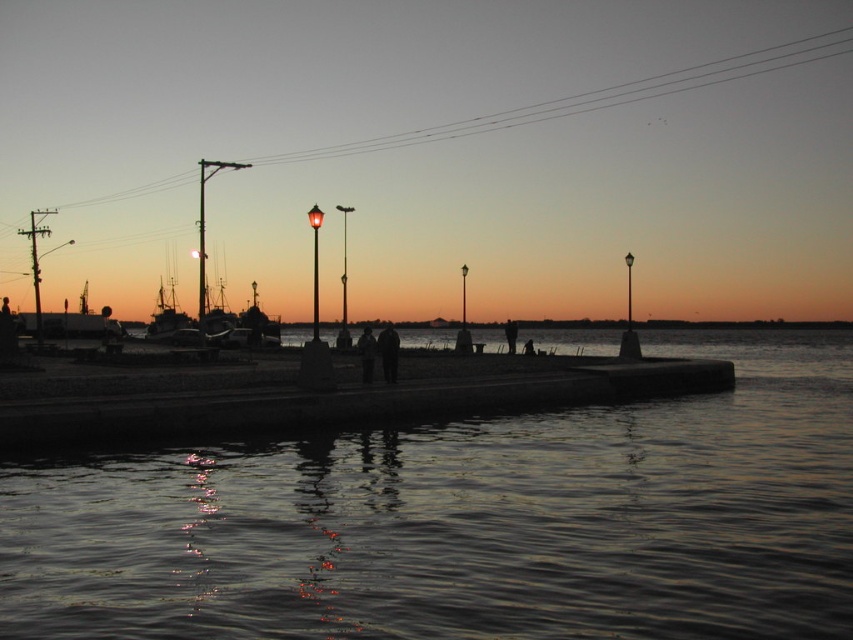
Question: Which point is closer to the camera taking this photo?

Choices:
 (A) (334, 394)
 (B) (511, 323)
 (C) (582, 531)

Answer: (C)

Question: Can you confirm if dark reflective water at center is positioned above dark blue jeans at center?

Choices:
 (A) no
 (B) yes

Answer: (A)

Question: Is concrete dock at center further to camera compared to dark textured pants at center?

Choices:
 (A) no
 (B) yes

Answer: (A)

Question: Estimate the real-world distances between objects in this image. Which object is closer to the dark reflective water at center?

Choices:
 (A) dark textured pants at center
 (B) concrete dock at center
 (C) dark blue jeans at center
 (D) silhouette figure at center

Answer: (B)

Question: Among these objects, which one is farthest from the camera?

Choices:
 (A) dark blue jeans at center
 (B) silhouette figure at center
 (C) dark reflective water at center
 (D) concrete dock at center

Answer: (B)

Question: Does dark reflective water at center appear on the left side of dark textured pants at center?

Choices:
 (A) no
 (B) yes

Answer: (A)